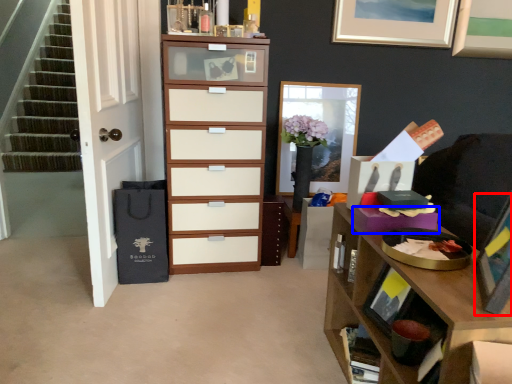
Question: Among these objects, which one is farthest to the camera, picture frame (highlighted by a red box) or drawer (highlighted by a blue box)?

Choices:
 (A) picture frame
 (B) drawer

Answer: (B)